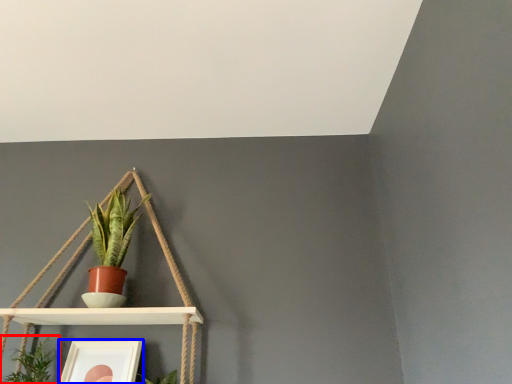
Question: Which object is closer to the camera taking this photo, houseplant (highlighted by a red box) or picture frame (highlighted by a blue box)?

Choices:
 (A) houseplant
 (B) picture frame

Answer: (A)